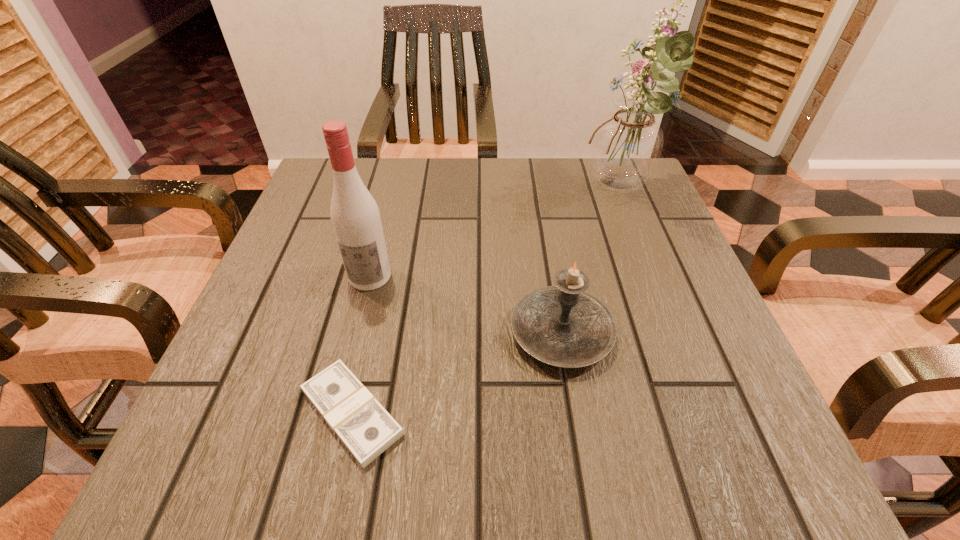
Locate an element on the screen. Image resolution: width=960 pixels, height=540 pixels. free space that satisfies the following two spatial constraints: 1. on the front-facing side of the rightmost object; 2. on the label of the third shortest object is located at coordinates (652, 276).

Where is `blank space that satisfies the following two spatial constraints: 1. on the label of the second tallest object; 2. on the left side of the third object from left to right`? The height and width of the screenshot is (540, 960). blank space that satisfies the following two spatial constraints: 1. on the label of the second tallest object; 2. on the left side of the third object from left to right is located at coordinates (356, 333).

The width and height of the screenshot is (960, 540). I want to click on vacant area in the image that satisfies the following two spatial constraints: 1. on the label of the dollar; 2. on the right side of the alcohol, so click(336, 413).

This screenshot has height=540, width=960. I want to click on vacant region that satisfies the following two spatial constraints: 1. on the front-facing side of the tallest object; 2. on the label of the alcohol, so (x=652, y=276).

At what (x,y) coordinates should I click in order to perform the action: click on blank area in the image that satisfies the following two spatial constraints: 1. on the label of the alcohol; 2. on the left side of the shortest object. Please return your answer as a coordinate pair (x, y). This screenshot has height=540, width=960. Looking at the image, I should click on (336, 413).

Identify the location of free location that satisfies the following two spatial constraints: 1. on the label of the candle; 2. on the right side of the third nearest object. This screenshot has height=540, width=960. (356, 333).

Locate an element on the screen. vacant space that satisfies the following two spatial constraints: 1. on the front-facing side of the farthest object; 2. on the label of the alcohol is located at coordinates (652, 276).